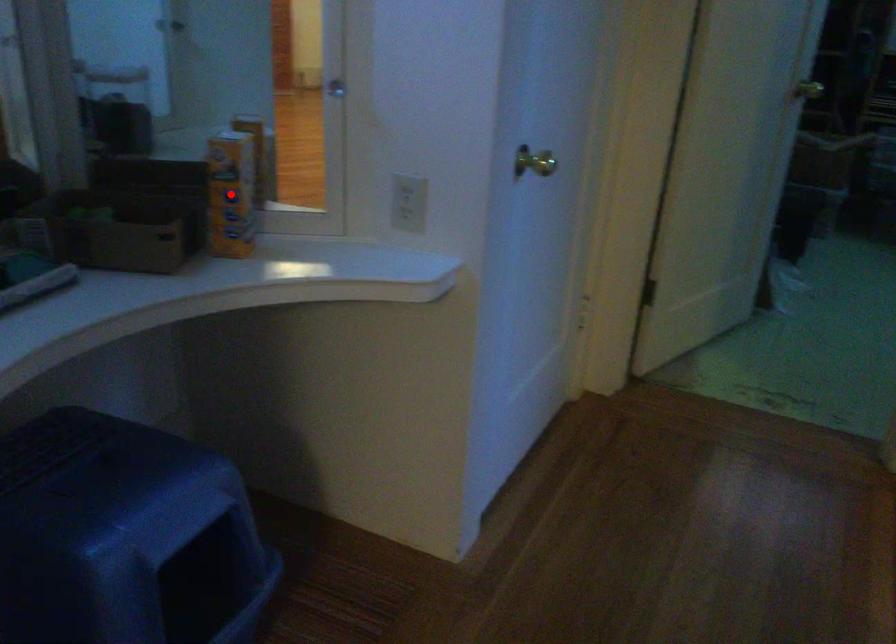
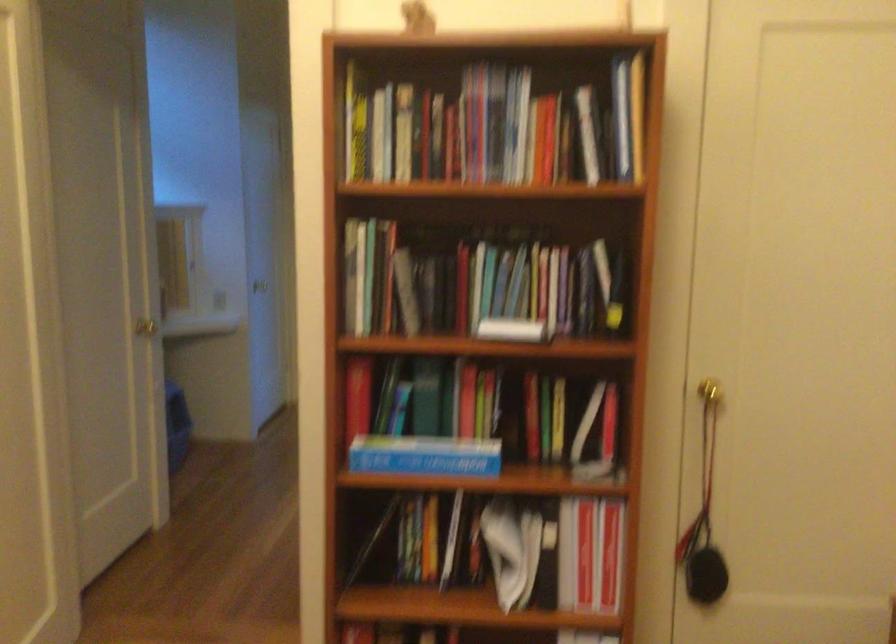
Question: I am providing you with two images of the same scene from different viewpoints. A red point is marked on the first image. Is the red point's position out of view in image 2?

Choices:
 (A) Yes
 (B) No

Answer: (A)